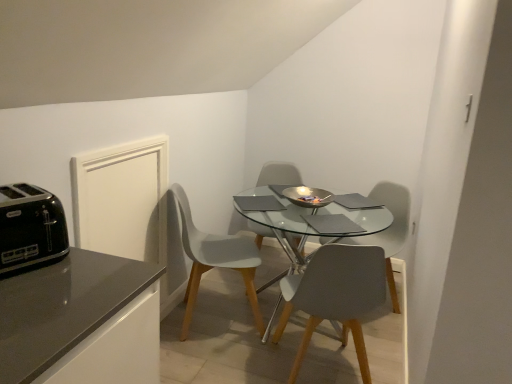
Question: Would you say black plastic toaster at left is outside transparent glass table at center?

Choices:
 (A) yes
 (B) no

Answer: (A)

Question: Does black plastic toaster at left lie behind transparent glass table at center?

Choices:
 (A) yes
 (B) no

Answer: (B)

Question: Considering the relative sizes of black plastic toaster at left and transparent glass table at center in the image provided, is black plastic toaster at left shorter than transparent glass table at center?

Choices:
 (A) no
 (B) yes

Answer: (B)

Question: Is black plastic toaster at left taller than transparent glass table at center?

Choices:
 (A) no
 (B) yes

Answer: (A)

Question: Would you say black plastic toaster at left is a long distance from transparent glass table at center?

Choices:
 (A) no
 (B) yes

Answer: (B)

Question: Is black plastic toaster at left bigger than transparent glass table at center?

Choices:
 (A) no
 (B) yes

Answer: (A)

Question: Can you confirm if matte gray chair at center, which is counted as the first chair, starting from the right, is smaller than black plastic toaster at left?

Choices:
 (A) no
 (B) yes

Answer: (A)

Question: Is there a large distance between matte gray chair at center, which is counted as the first chair, starting from the right, and black plastic toaster at left?

Choices:
 (A) yes
 (B) no

Answer: (A)

Question: Considering the relative sizes of matte gray chair at center, which is counted as the first chair, starting from the right, and black plastic toaster at left in the image provided, is matte gray chair at center, which is counted as the first chair, starting from the right, thinner than black plastic toaster at left?

Choices:
 (A) yes
 (B) no

Answer: (B)

Question: From the image's perspective, is matte gray chair at center, which is counted as the first chair, starting from the right, over black plastic toaster at left?

Choices:
 (A) yes
 (B) no

Answer: (B)

Question: Is matte gray chair at center, which is counted as the first chair, starting from the right, looking in the opposite direction of black plastic toaster at left?

Choices:
 (A) yes
 (B) no

Answer: (B)

Question: Is the position of matte gray chair at center, which is counted as the first chair, starting from the right, less distant than that of black plastic toaster at left?

Choices:
 (A) no
 (B) yes

Answer: (A)

Question: Considering the relative sizes of matte gray chair at center, which is counted as the 4th chair, starting from the left, and transparent glass table at center in the image provided, is matte gray chair at center, which is counted as the 4th chair, starting from the left, bigger than transparent glass table at center?

Choices:
 (A) no
 (B) yes

Answer: (A)